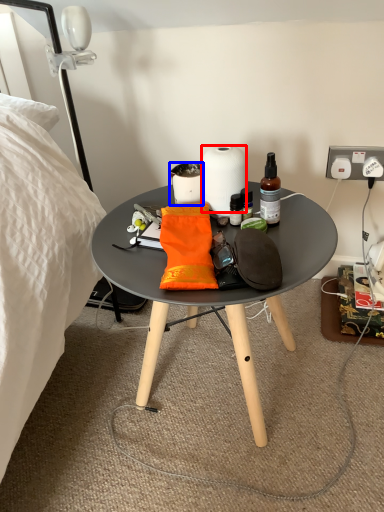
Question: Which of the following is the farthest to the observer, paper towel (highlighted by a red box) or coffee cup (highlighted by a blue box)?

Choices:
 (A) paper towel
 (B) coffee cup

Answer: (B)